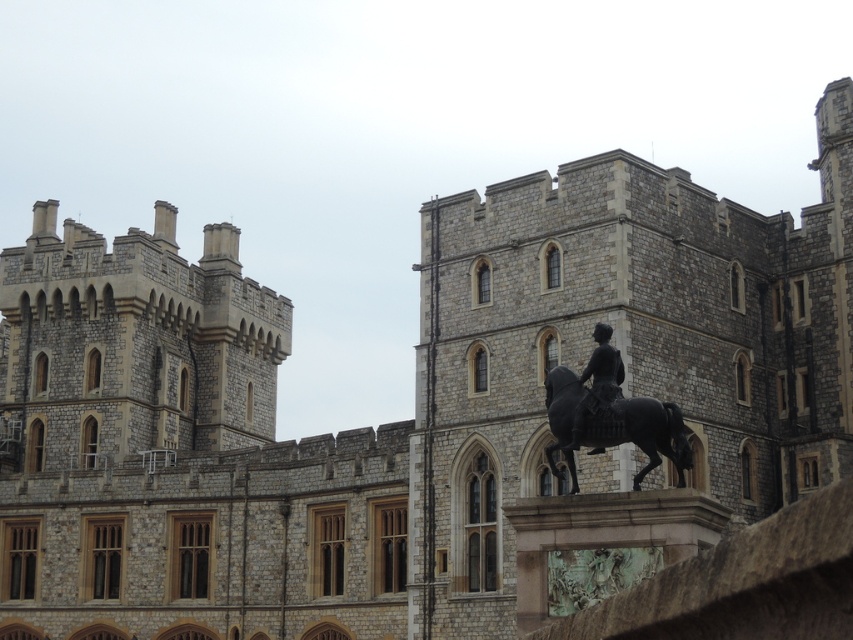
Is the position of shiny black horse at center more distant than that of polished bronze statue at center?

No, shiny black horse at center is closer to the viewer.

Locate an element on the screen. shiny black horse at center is located at coordinates pos(641,433).